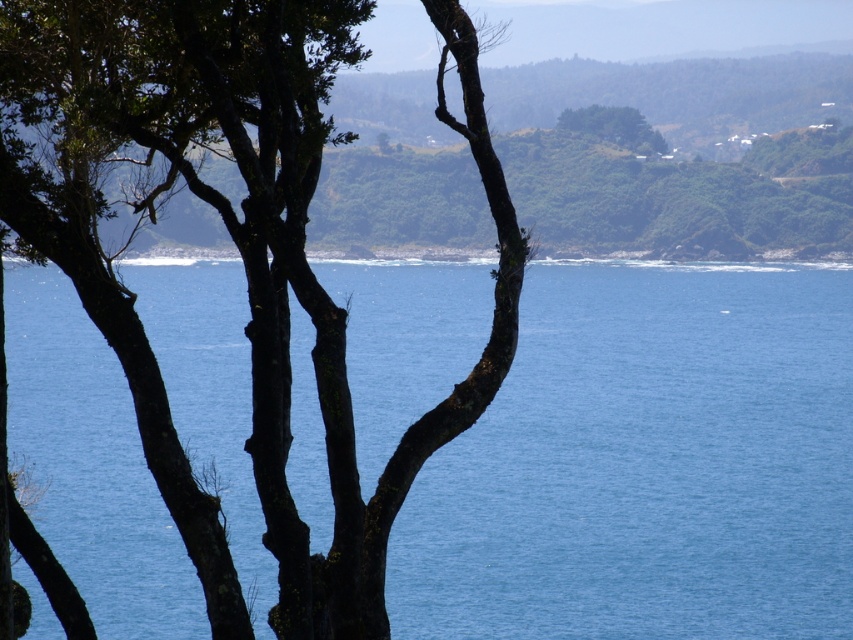
Question: Observing the image, what is the correct spatial positioning of green rough bark tree at left in reference to green leafy tree at upper center?

Choices:
 (A) above
 (B) below

Answer: (B)

Question: Which point is closer to the camera?

Choices:
 (A) (77, 244)
 (B) (647, 140)

Answer: (A)

Question: Is green rough bark tree at left further to camera compared to green leafy tree at upper center?

Choices:
 (A) yes
 (B) no

Answer: (B)

Question: Is blue water at center above green rough bark tree at left?

Choices:
 (A) no
 (B) yes

Answer: (A)

Question: Which point appears farthest from the camera in this image?

Choices:
 (A) (608, 109)
 (B) (166, 400)

Answer: (A)

Question: Among these objects, which one is nearest to the camera?

Choices:
 (A) green leafy tree at upper center
 (B) green rough bark tree at left
 (C) blue water at center

Answer: (B)